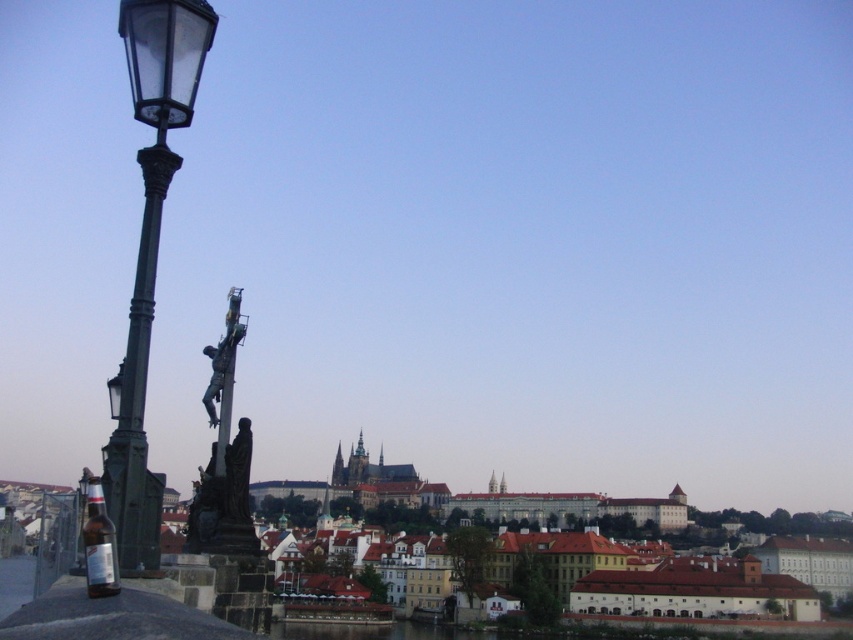
Question: Does matte black street light at left appear over translucent glass bottle at lower left?

Choices:
 (A) yes
 (B) no

Answer: (A)

Question: Does matte black street light at left lie in front of translucent glass bottle at lower left?

Choices:
 (A) no
 (B) yes

Answer: (A)

Question: Is black metal pole at left below translucent glass bottle at lower left?

Choices:
 (A) no
 (B) yes

Answer: (A)

Question: Which object is the farthest from the black metal pole at left?

Choices:
 (A) translucent glass bottle at lower left
 (B) matte black street light at left

Answer: (A)

Question: Which object appears farthest from the camera in this image?

Choices:
 (A) black metal pole at left
 (B) matte black street light at left
 (C) translucent glass bottle at lower left

Answer: (A)

Question: Among these points, which one is farthest from the camera?

Choices:
 (A) pos(134,410)
 (B) pos(93,524)

Answer: (A)